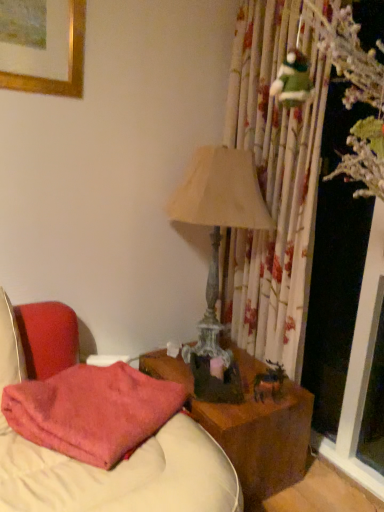
Question: Is point (263, 222) positioned closer to the camera than point (130, 381)?

Choices:
 (A) closer
 (B) farther

Answer: (B)

Question: Considering the relative positions of matte beige lampshade at center-right and pink fuzzy pillow at lower left in the image provided, is matte beige lampshade at center-right to the left or to the right of pink fuzzy pillow at lower left?

Choices:
 (A) left
 (B) right

Answer: (B)

Question: Based on their relative distances, which object is farther from the pink fuzzy pillow at lower left?

Choices:
 (A) wooden nightstand at center
 (B) matte beige lampshade at center-right

Answer: (B)

Question: Based on their relative distances, which object is nearer to the pink fuzzy pillow at lower left?

Choices:
 (A) matte beige lampshade at center-right
 (B) wooden nightstand at center

Answer: (B)